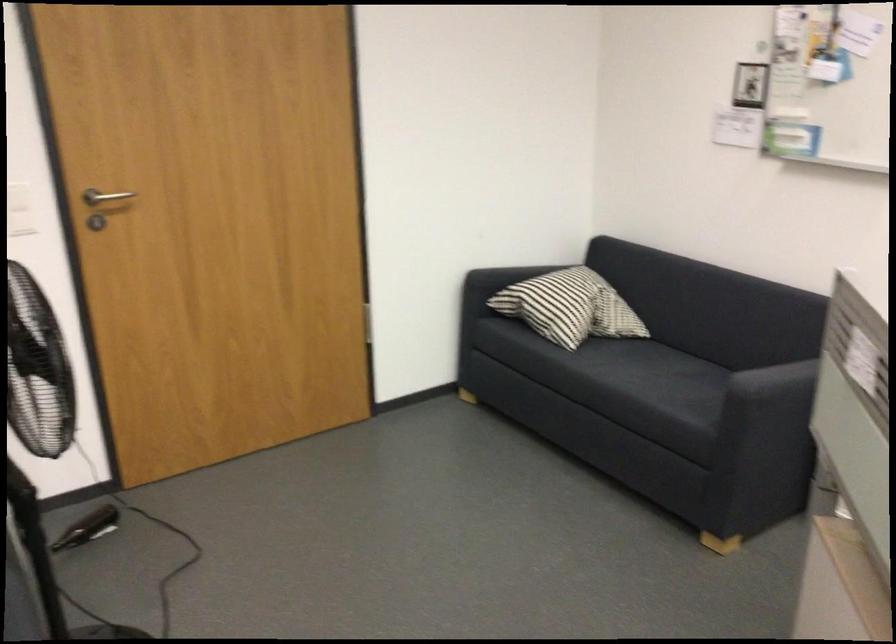
The width and height of the screenshot is (896, 644). I want to click on sofa sitting surface, so click(668, 370).